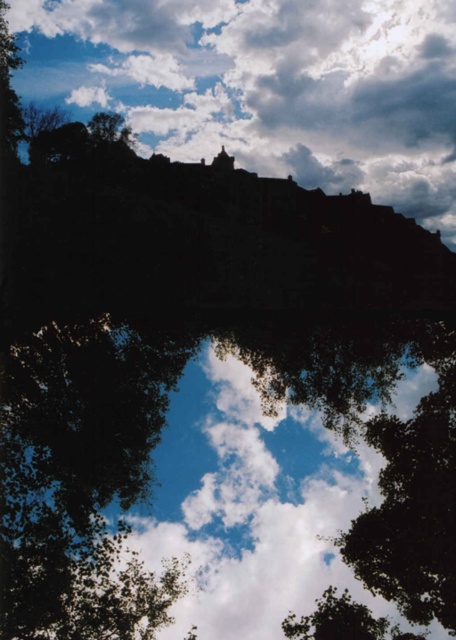
You are an artist trying to paint the scene of Edinburgh Castle. You notice the white fluffy cloud at upper center and the green leafy tree at upper center. Which one do you see higher in the sky?

The white fluffy cloud at upper center is located above the green leafy tree at upper center, so it appears higher in the sky.

You are an artist sketching the castle scene. You notice the green leafy tree at upper center and the white fluffy cloud at upper center. Which one appears closer to you in your drawing?

The white fluffy cloud at upper center appears closer because the green leafy tree at upper center is behind it.

You are an artist sketching the castle scene. You notice the white fluffy cloud at upper center and the green leafy tree at upper center in your drawing. Which one should you draw taller to maintain accuracy?

To maintain accuracy, you should draw the white fluffy cloud at upper center taller than the green leafy tree at upper center because the cloud is taller than the tree in the scene.